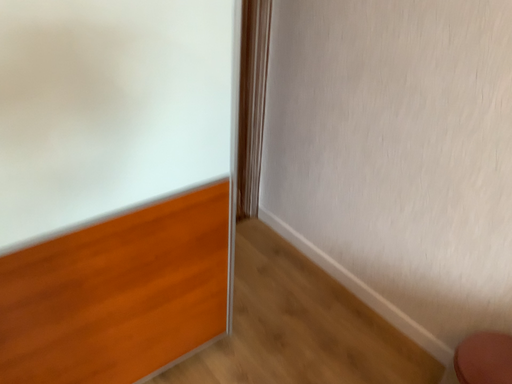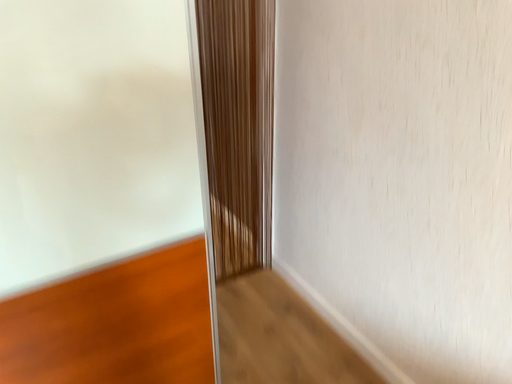
Question: How did the camera likely rotate when shooting the video?

Choices:
 (A) rotated left
 (B) rotated right

Answer: (A)